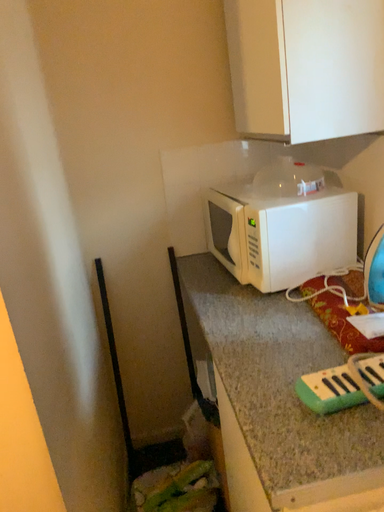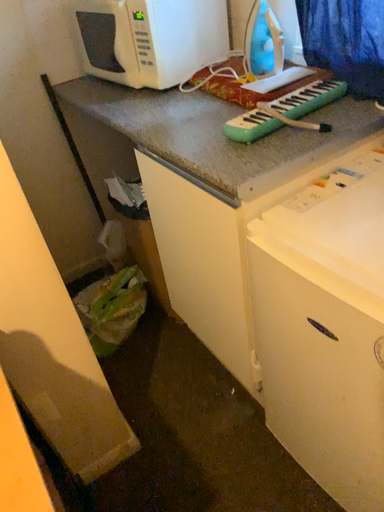
Question: Which way did the camera rotate in the video?

Choices:
 (A) rotated right
 (B) rotated left

Answer: (A)